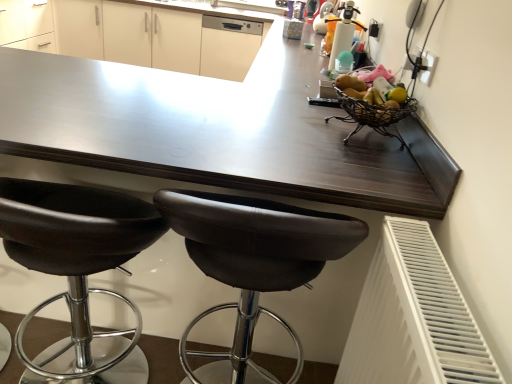
Question: From the image's perspective, does black plastic socket at upper right appear higher than white glossy dishwasher at upper center?

Choices:
 (A) no
 (B) yes

Answer: (A)

Question: Does black plastic socket at upper right appear on the right side of white glossy dishwasher at upper center?

Choices:
 (A) yes
 (B) no

Answer: (A)

Question: Is black plastic socket at upper right outside of white glossy dishwasher at upper center?

Choices:
 (A) yes
 (B) no

Answer: (A)

Question: Can white glossy dishwasher at upper center be found inside black plastic socket at upper right?

Choices:
 (A) yes
 (B) no

Answer: (B)

Question: Does black plastic socket at upper right turn towards white glossy dishwasher at upper center?

Choices:
 (A) yes
 (B) no

Answer: (B)

Question: From the image's perspective, is black plastic socket at upper right located beneath white glossy dishwasher at upper center?

Choices:
 (A) no
 (B) yes

Answer: (B)

Question: Can you confirm if black leather stool at lower left, the second chair viewed from the right, is taller than white plastic radiator at lower right?

Choices:
 (A) no
 (B) yes

Answer: (B)

Question: Does black leather stool at lower left, arranged as the first chair when viewed from the left, have a lesser width compared to white plastic radiator at lower right?

Choices:
 (A) yes
 (B) no

Answer: (B)

Question: Considering the relative positions of black leather stool at lower left, arranged as the first chair when viewed from the left, and white plastic radiator at lower right in the image provided, is black leather stool at lower left, arranged as the first chair when viewed from the left, to the left of white plastic radiator at lower right from the viewer's perspective?

Choices:
 (A) yes
 (B) no

Answer: (A)

Question: Is black leather stool at lower left, the second chair viewed from the right, beside white plastic radiator at lower right?

Choices:
 (A) yes
 (B) no

Answer: (B)

Question: Is black leather stool at lower left, the second chair viewed from the right, positioned in front of white plastic radiator at lower right?

Choices:
 (A) no
 (B) yes

Answer: (A)

Question: From a real-world perspective, is black leather stool at lower left, arranged as the first chair when viewed from the left, physically below white plastic radiator at lower right?

Choices:
 (A) yes
 (B) no

Answer: (A)

Question: Is black plastic socket at upper right beside black leather stool at lower left, arranged as the first chair when viewed from the left?

Choices:
 (A) yes
 (B) no

Answer: (B)